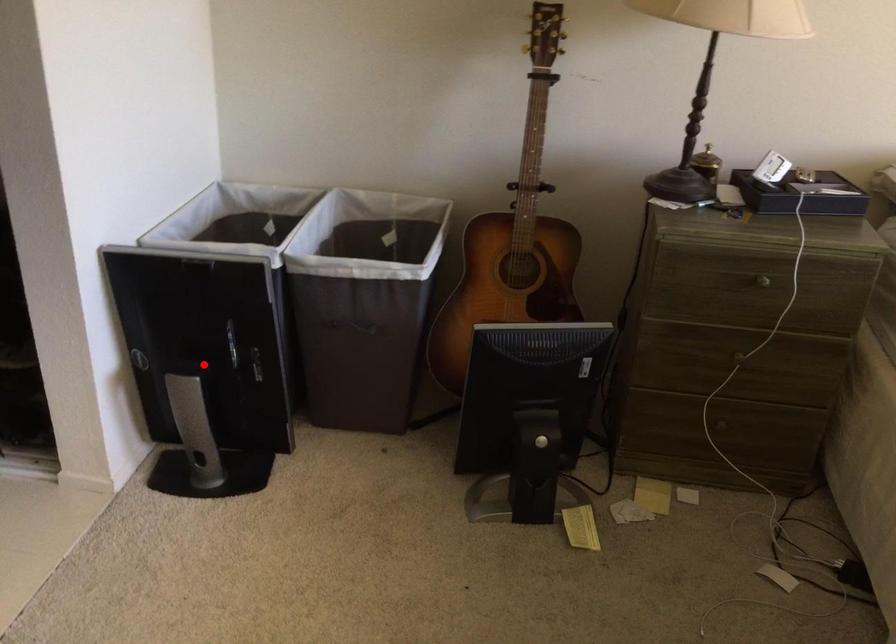
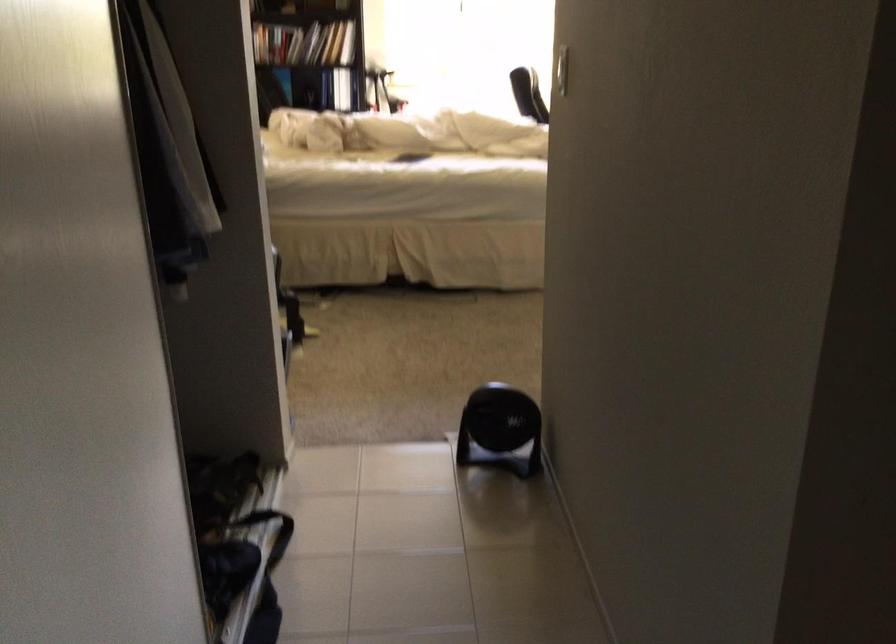
Question: I am providing you with two images of the same scene from different viewpoints. A red point is marked on the first image. At the location where the point appears in image 1, is it still visible in image 2?

Choices:
 (A) Yes
 (B) No

Answer: (B)